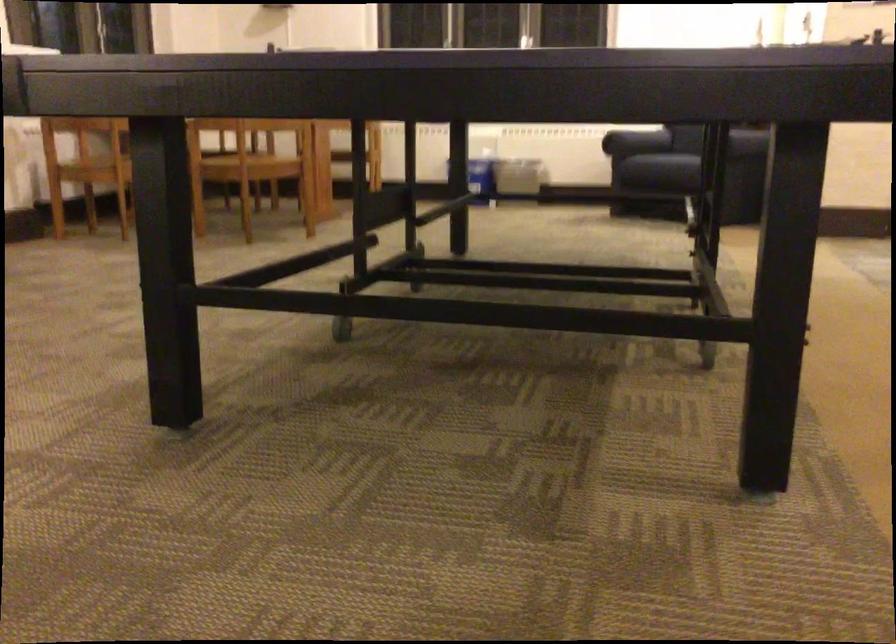
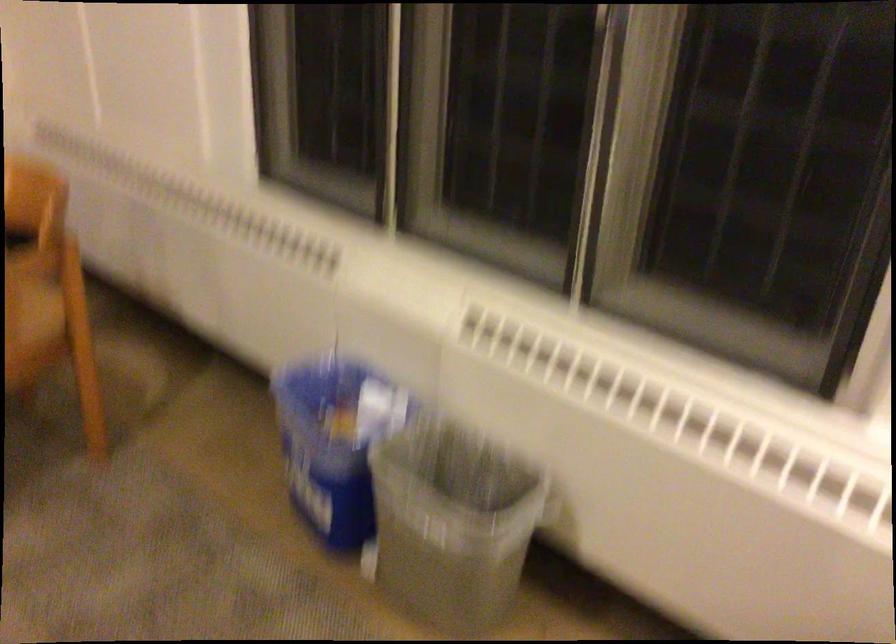
In the second image, find the point that corresponds to the point at 538,162 in the first image.

(451, 524)